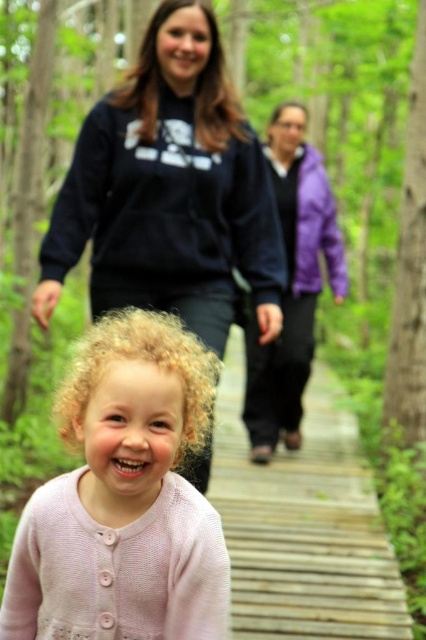
Question: Is pink knitted sweater at center bigger than purple fleece jacket at center?

Choices:
 (A) yes
 (B) no

Answer: (B)

Question: Which object is closer to the camera taking this photo?

Choices:
 (A) purple fleece jacket at center
 (B) dark blue sweatshirt at upper center

Answer: (B)

Question: In this image, where is wooden planks at center located relative to purple matte sweatshirt at upper center?

Choices:
 (A) above
 (B) below

Answer: (B)

Question: Which object appears closest to the camera in this image?

Choices:
 (A) dark blue fleece sweatshirt at upper center
 (B) purple fleece jacket at center
 (C) dark blue sweatshirt at upper center
 (D) purple matte sweatshirt at upper center

Answer: (C)

Question: Which of the following is the closest to the observer?

Choices:
 (A) (310, 145)
 (B) (331, 221)

Answer: (B)

Question: Is dark blue fleece sweatshirt at upper center above purple matte sweatshirt at upper center?

Choices:
 (A) yes
 (B) no

Answer: (B)